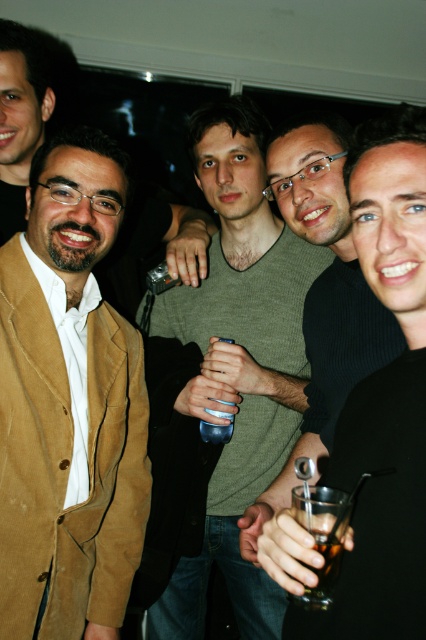
Consider the image. You are at a party and want to grab a drink. You see a black matte glass at center and a clear plastic cup at center. Which one is larger in size?

The black matte glass at center is bigger than the clear plastic cup at center.

You are at a party and want to take a photo of the clear plastic cup at center without the green knitwear at center blocking it. How can you adjust your position to achieve this?

Move your position so that the green knitwear at center is no longer in front of the clear plastic cup at center. Since the green knitwear at center is currently in front of the clear plastic cup at center, moving around it or shifting your angle would allow you to capture the cup without obstruction.